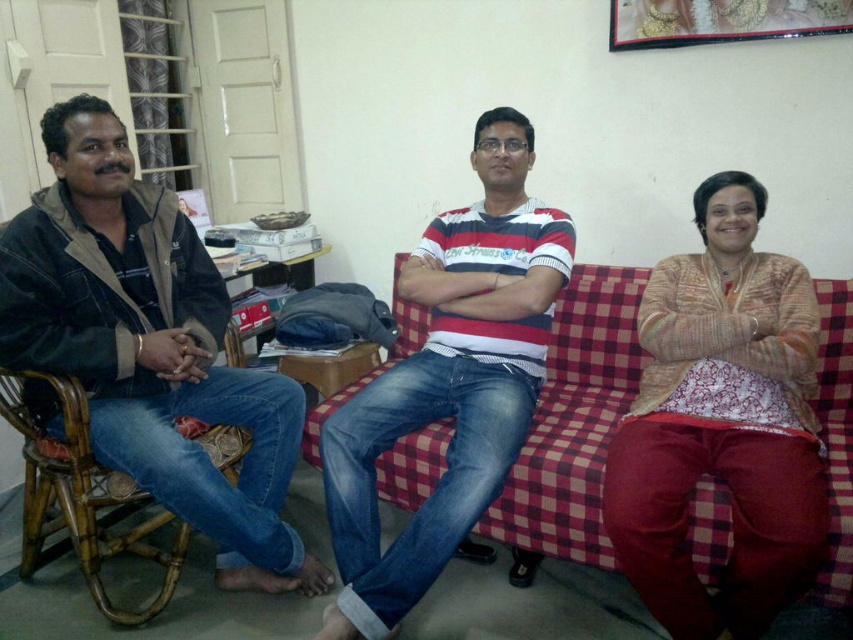
Is denim jeans at left behind beige textured sweater at center?

Yes, denim jeans at left is behind beige textured sweater at center.

In the scene shown: Does denim jeans at left appear over beige textured sweater at center?

Correct, denim jeans at left is located above beige textured sweater at center.

Measure the distance between point (258, 490) and camera.

The distance of point (258, 490) from camera is 1.94 meters.

Identify the location of denim jeans at left. Image resolution: width=853 pixels, height=640 pixels. (149, 346).

Who is shorter, beige textured sweater at center or striped cotton shirt at center?

Standing shorter between the two is beige textured sweater at center.

Who is more forward, (715, 305) or (462, 483)?

Point (462, 483)

At what (x,y) coordinates should I click in order to perform the action: click on beige textured sweater at center. Please return your answer as a coordinate pair (x, y). Looking at the image, I should click on (722, 424).

In order to click on beige textured sweater at center in this screenshot , I will do `click(722, 424)`.

Which is more to the right, checkered fabric couch at center or gold metallic picture frame at upper center?

Positioned to the right is gold metallic picture frame at upper center.

Does checkered fabric couch at center have a smaller size compared to gold metallic picture frame at upper center?

Incorrect, checkered fabric couch at center is not smaller in size than gold metallic picture frame at upper center.

Is point (581, 268) closer to viewer compared to point (679, 6)?

No, it is not.

I want to click on checkered fabric couch at center, so click(573, 420).